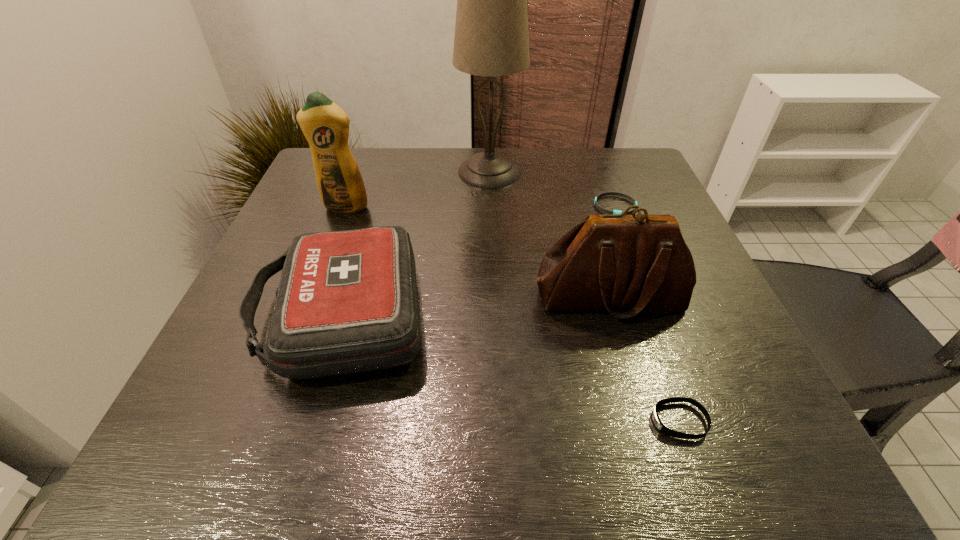
Where is `object identified as the second closest to the nearer wristband`? The image size is (960, 540). object identified as the second closest to the nearer wristband is located at coordinates (347, 302).

Where is `the fifth closest object to the first-aid kit`? the fifth closest object to the first-aid kit is located at coordinates (626, 196).

Locate an element on the screen. The height and width of the screenshot is (540, 960). vacant position in the image that satisfies the following two spatial constraints: 1. on the buckle of the shortest object; 2. on the display of the second shortest object is located at coordinates [697, 421].